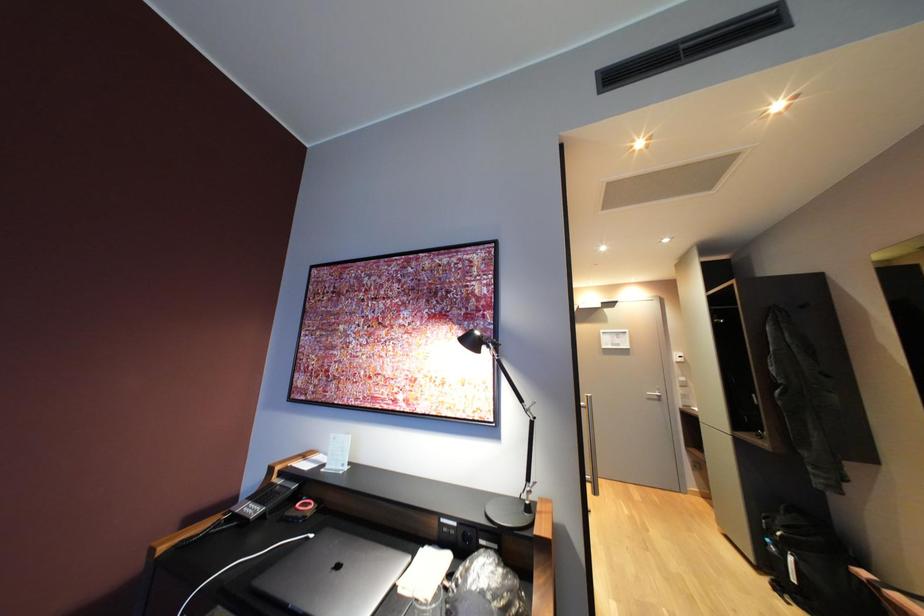
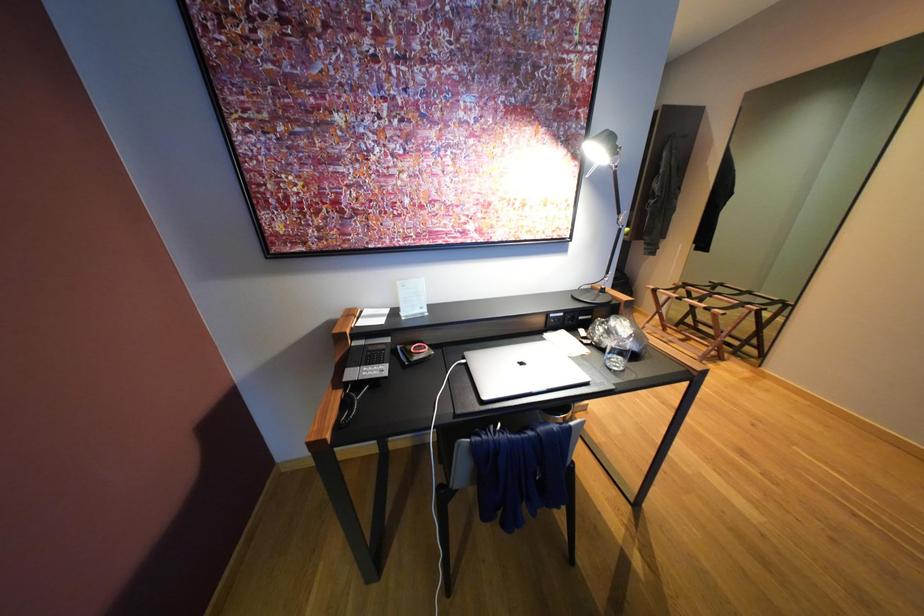
The images are taken continuously from a first-person perspective. In which direction is your viewpoint rotating?

The camera rotated toward right-down.